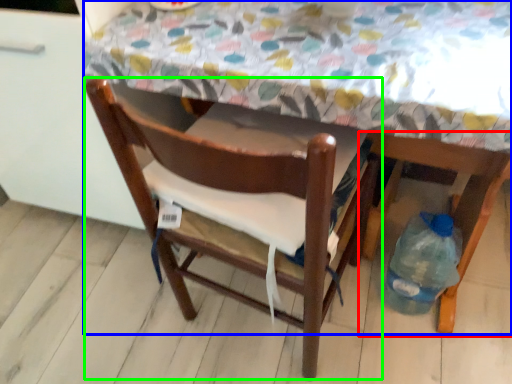
Question: Considering the real-world distances, which object is closest to chair (highlighted by a red box)? table (highlighted by a blue box) or chair (highlighted by a green box).

Choices:
 (A) table
 (B) chair

Answer: (B)